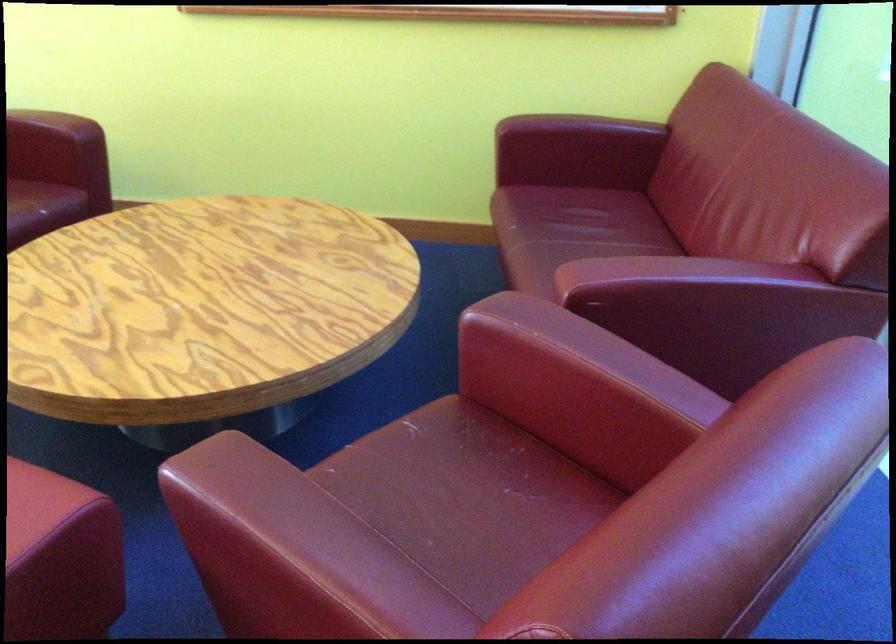
Find the location of a particular element. This screenshot has width=896, height=644. red sofa sitting surface is located at coordinates pos(592,210).